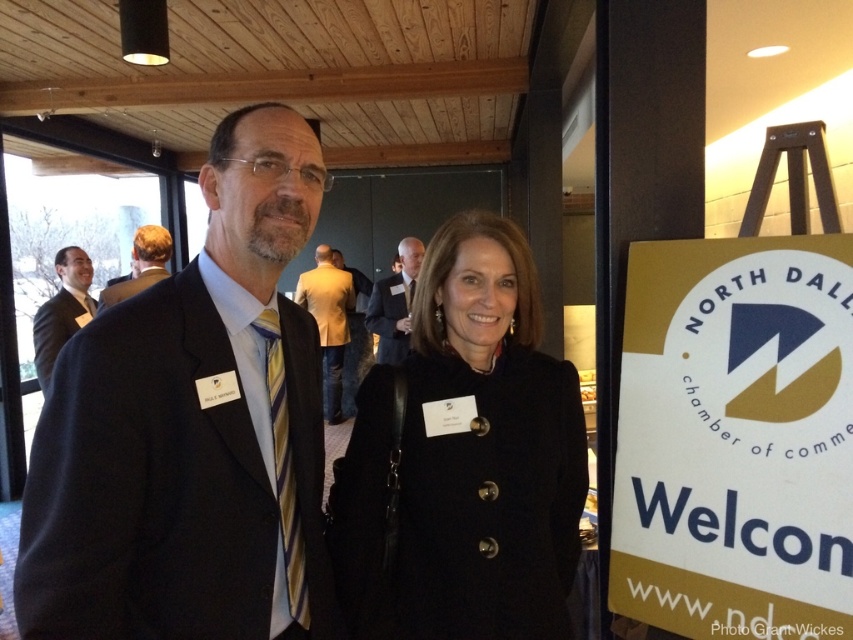
Question: Which of the following is the farthest from the observer?

Choices:
 (A) white paper sign at right
 (B) matte black suit at left

Answer: (B)

Question: Does white paper sign at right come in front of matte black suit at left?

Choices:
 (A) yes
 (B) no

Answer: (A)

Question: Considering the relative positions of matte black suit at center and golden leather jacket at center in the image provided, where is matte black suit at center located with respect to golden leather jacket at center?

Choices:
 (A) below
 (B) above

Answer: (A)

Question: Which of the following is the farthest from the observer?

Choices:
 (A) matte black suit at left
 (B) dark suit at center
 (C) light brown hair at upper left
 (D) matte black suit at center

Answer: (B)

Question: Does matte black suit at center have a smaller size compared to dark suit at center?

Choices:
 (A) no
 (B) yes

Answer: (B)

Question: Which is farther from the light brown hair at upper left?

Choices:
 (A) matte black suit at center
 (B) matte black suit at left

Answer: (A)